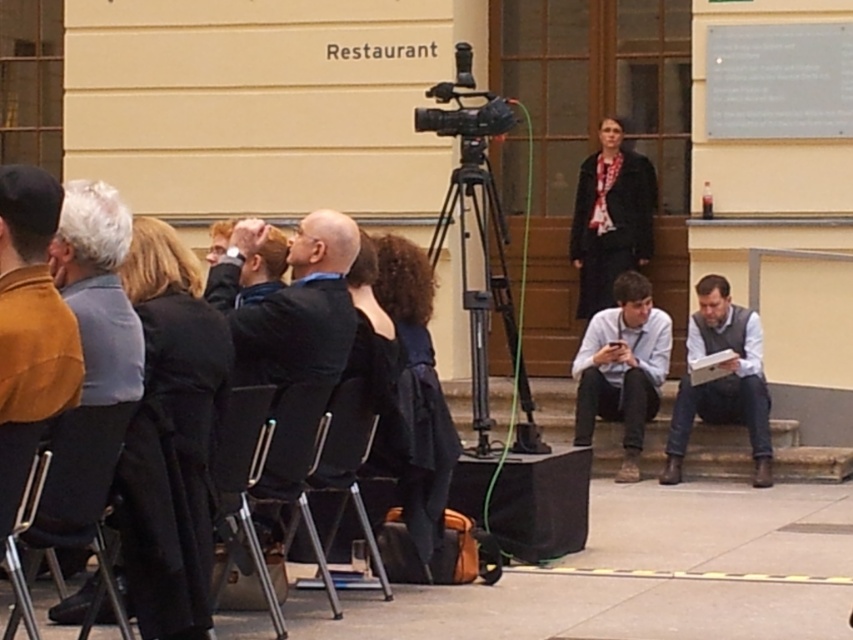
The width and height of the screenshot is (853, 640). Describe the element at coordinates (264, 461) in the screenshot. I see `metallic silver chair at lower center` at that location.

Between point (258, 397) and point (750, 432), which one is positioned in front?

Point (258, 397) is in front.

Identify the location of metallic silver chair at lower center. The height and width of the screenshot is (640, 853). (264, 461).

At what (x,y) coordinates should I click in order to perform the action: click on metallic silver chair at lower center. Please return your answer as a coordinate pair (x, y). Looking at the image, I should click on (264, 461).

Which is more to the left, black metal tripod at center or matte black video camera at center?

matte black video camera at center

Can you confirm if black metal tripod at center is positioned to the right of matte black video camera at center?

Yes, black metal tripod at center is to the right of matte black video camera at center.

The width and height of the screenshot is (853, 640). What do you see at coordinates (486, 289) in the screenshot? I see `black metal tripod at center` at bounding box center [486, 289].

Identify the location of black metal tripod at center. The image size is (853, 640). (486, 289).

Does gray metallic plaque at upper right have a lesser width compared to metallic silver chair at center?

No, gray metallic plaque at upper right is not thinner than metallic silver chair at center.

Does gray metallic plaque at upper right have a lesser height compared to metallic silver chair at center?

Correct, gray metallic plaque at upper right is not as tall as metallic silver chair at center.

Between point (706, 67) and point (312, 474), which one is positioned behind?

Positioned behind is point (706, 67).

The height and width of the screenshot is (640, 853). Identify the location of gray metallic plaque at upper right. (778, 81).